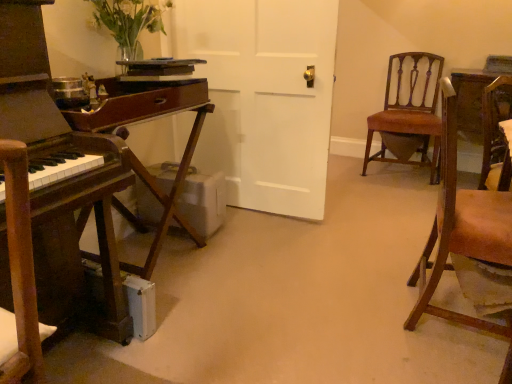
The width and height of the screenshot is (512, 384). I want to click on spots to the right of brown wood table at left, so click(254, 278).